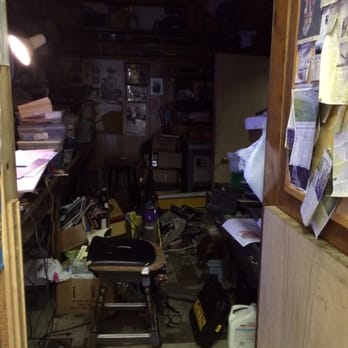
At what (x,y) coordinates should I click in order to perform the action: click on floor. Please return your answer as a coordinate pair (x, y). Looking at the image, I should click on point(189,338).